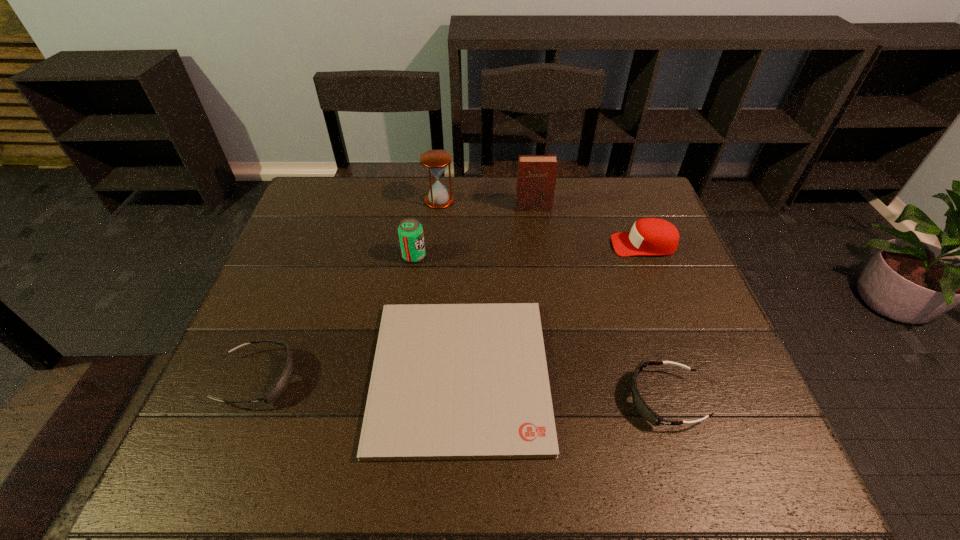
Find the location of a particular element. This screenshot has height=540, width=960. free spot located on the front-facing side of the baseball cap is located at coordinates (479, 245).

The image size is (960, 540). I want to click on vacant space located 0.380m on the front-facing side of the baseball cap, so click(x=479, y=245).

This screenshot has width=960, height=540. In order to click on free location located 0.390m on the front-facing side of the baseball cap in this screenshot , I will do `click(475, 245)`.

Where is `vacant space situated on the lenses of the left goggles`? The width and height of the screenshot is (960, 540). vacant space situated on the lenses of the left goggles is located at coordinates (342, 379).

The width and height of the screenshot is (960, 540). In order to click on free space located on the front and sides of the right goggles in this screenshot , I will do 581,399.

Locate an element on the screen. The image size is (960, 540). vacant region located on the front and sides of the right goggles is located at coordinates (566, 399).

At what (x,y) coordinates should I click in order to perform the action: click on free space located on the front and sides of the right goggles. Please return your answer as a coordinate pair (x, y). Looking at the image, I should click on (462, 399).

Image resolution: width=960 pixels, height=540 pixels. In order to click on vacant region located on the back of the shortest object in this screenshot , I will do `click(465, 258)`.

Find the location of `diary located in the far edge section of the desktop`. diary located in the far edge section of the desktop is located at coordinates (536, 178).

The width and height of the screenshot is (960, 540). I want to click on hourglass located at the far edge, so click(x=436, y=161).